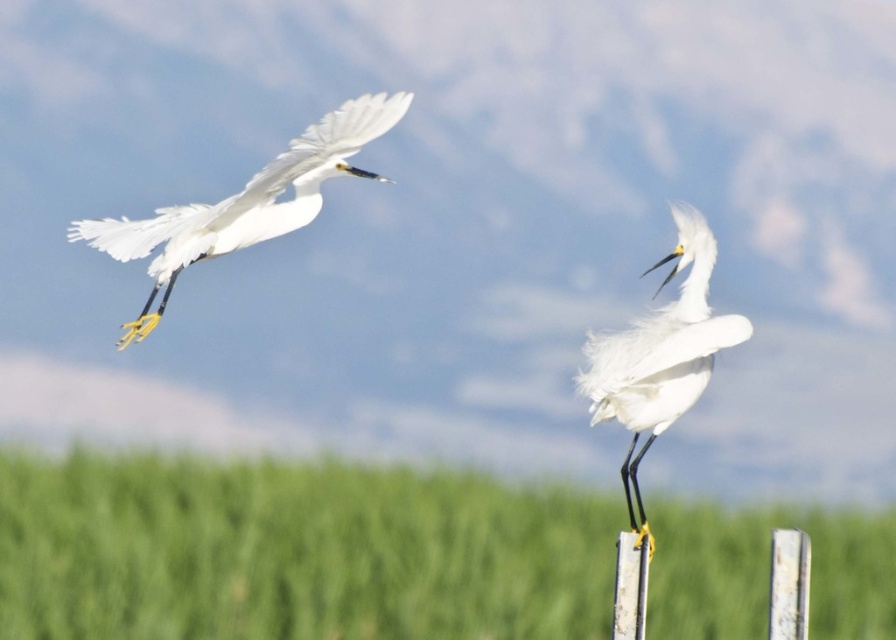
From the picture: Is white feathered bird at left below white fluffy bird at center?

No.

Which is in front, point (255, 230) or point (629, 339)?

Point (629, 339)

Where is `white feathered bird at left`? white feathered bird at left is located at coordinates (246, 202).